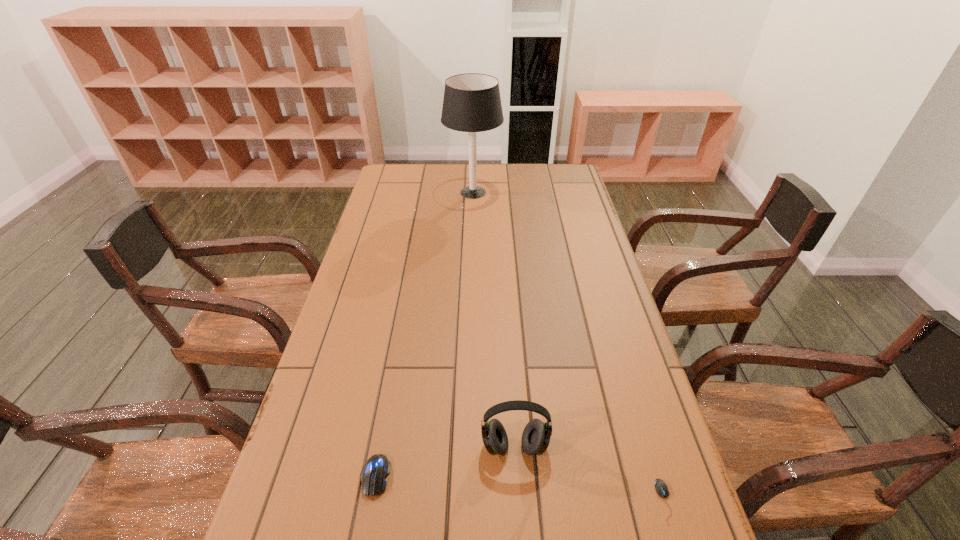
You are a GUI agent. You are given a task and a screenshot of the screen. Output one action in this format:
    pyautogui.click(x=<x>, y=<y>)
    Task: Click on the vacant space that satisfies the following two spatial constraints: 1. on the ear cups of the right mouse; 2. on the left side of the second tallest object
    
    Given the screenshot: What is the action you would take?
    pyautogui.click(x=518, y=501)

You are a GUI agent. You are given a task and a screenshot of the screen. Output one action in this format:
    pyautogui.click(x=<x>, y=<y>)
    Task: Click on the vacant space that satisfies the following two spatial constraints: 1. on the front side of the shortest object; 2. on the right side of the farthest object
    The width and height of the screenshot is (960, 540).
    Given the screenshot: What is the action you would take?
    pyautogui.click(x=467, y=501)